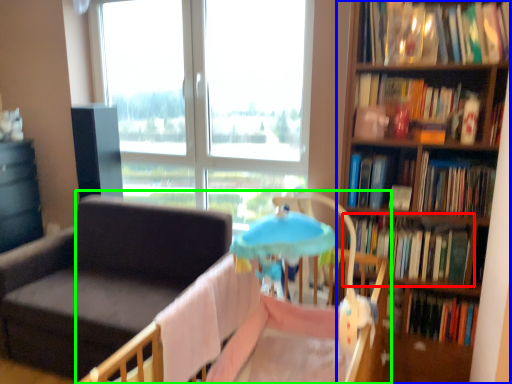
Question: Considering the real-world distances, which object is closest to book (highlighted by a red box)? bookcase (highlighted by a blue box) or infant bed (highlighted by a green box).

Choices:
 (A) bookcase
 (B) infant bed

Answer: (A)